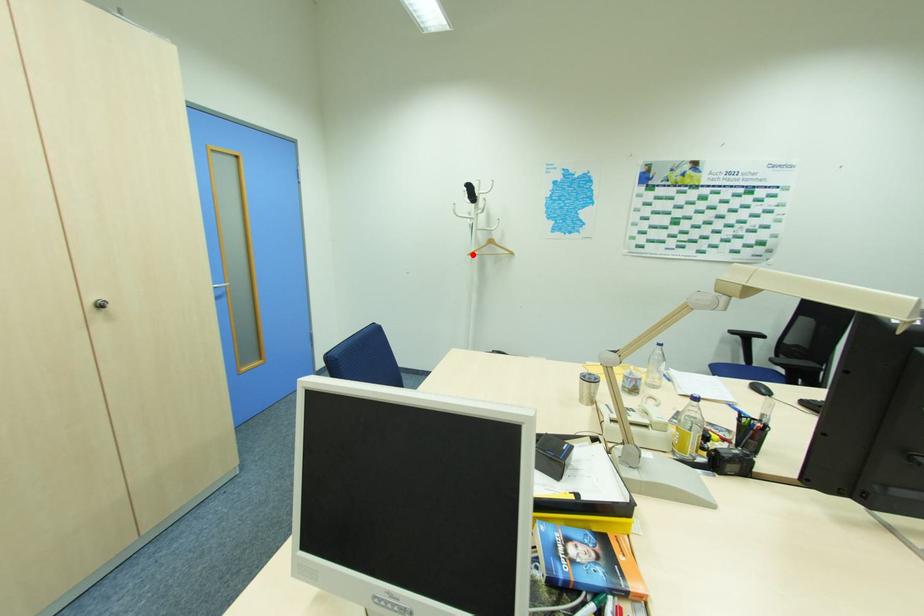
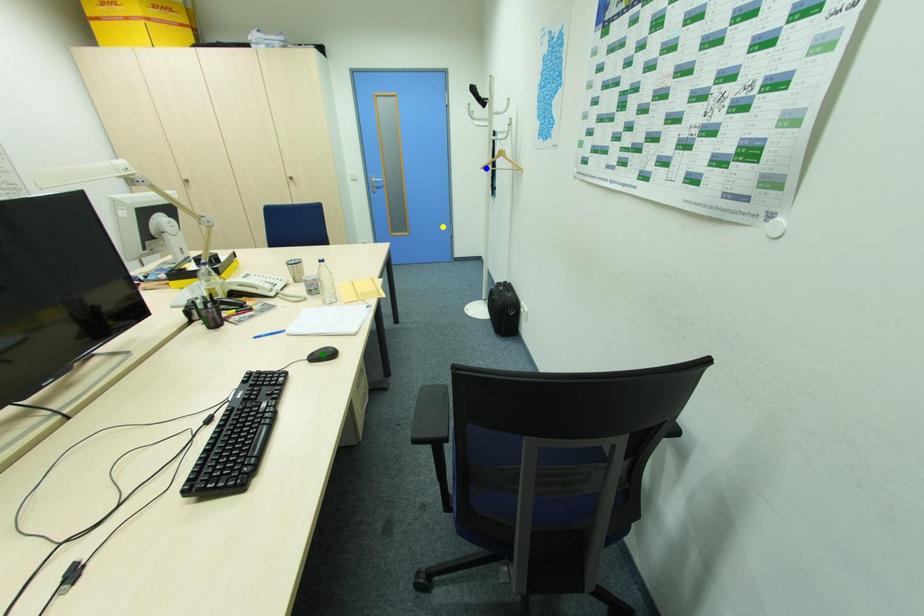
Question: I am providing you with two images of the same scene from different viewpoints. A red point is marked on the first image. You are given multiple points on the second image. Which mark in image 2 goes with the point in image 1?

Choices:
 (A) blue point
 (B) yellow point
 (C) green point

Answer: (A)